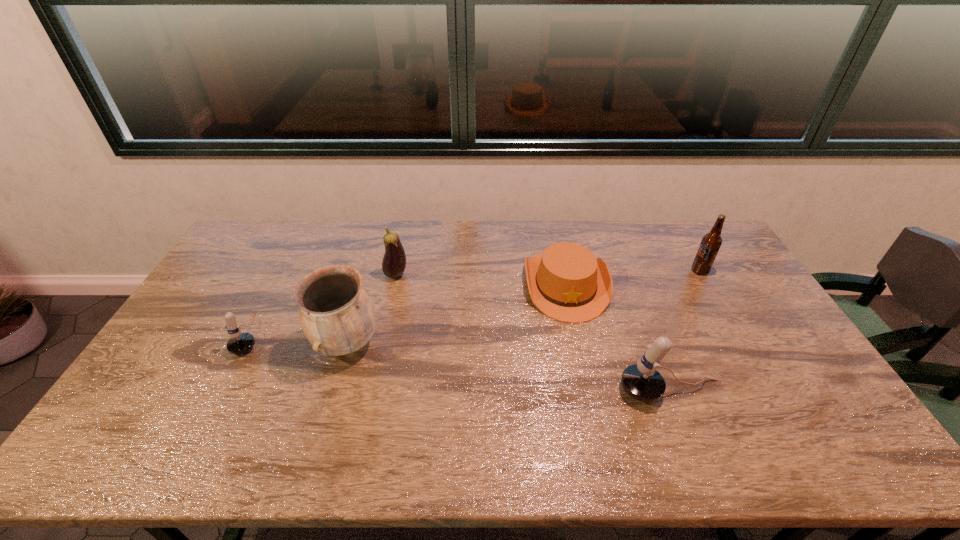
The height and width of the screenshot is (540, 960). What are the coordinates of `empty location between the urn and the beer bottle` in the screenshot? It's located at (523, 307).

This screenshot has height=540, width=960. What are the coordinates of `free spot between the urn and the rightmost object` in the screenshot? It's located at pos(523,307).

You are a GUI agent. You are given a task and a screenshot of the screen. Output one action in this format:
    pyautogui.click(x=<x>, y=<y>)
    Task: Click on the vacant area that lies between the shorter microphone and the beer bottle
    The image size is (960, 540).
    Given the screenshot: What is the action you would take?
    pyautogui.click(x=475, y=303)

Identify which object is the second closest to the eggplant. Please provide its 2D coordinates. Your answer should be formatted as a tuple, i.e. [(x, y)], where the tuple contains the x and y coordinates of a point satisfying the conditions above.

[(239, 343)]

The height and width of the screenshot is (540, 960). In order to click on object that is the second closest one to the shortest object in this screenshot , I will do `click(711, 242)`.

At what (x,y) coordinates should I click in order to perform the action: click on free location that satisfies the following two spatial constraints: 1. on the label of the rightmost object; 2. on the front-facing side of the cowboy hat. Please return your answer as a coordinate pair (x, y). Looking at the image, I should click on (708, 284).

What are the coordinates of `vacant point that satisfies the following two spatial constraints: 1. on the label of the rightmost object; 2. on the front side of the urn` in the screenshot? It's located at (742, 343).

This screenshot has height=540, width=960. Find the location of `free space that satisfies the following two spatial constraints: 1. on the label of the beer bottle; 2. on the front side of the urn`. free space that satisfies the following two spatial constraints: 1. on the label of the beer bottle; 2. on the front side of the urn is located at coordinates (742, 343).